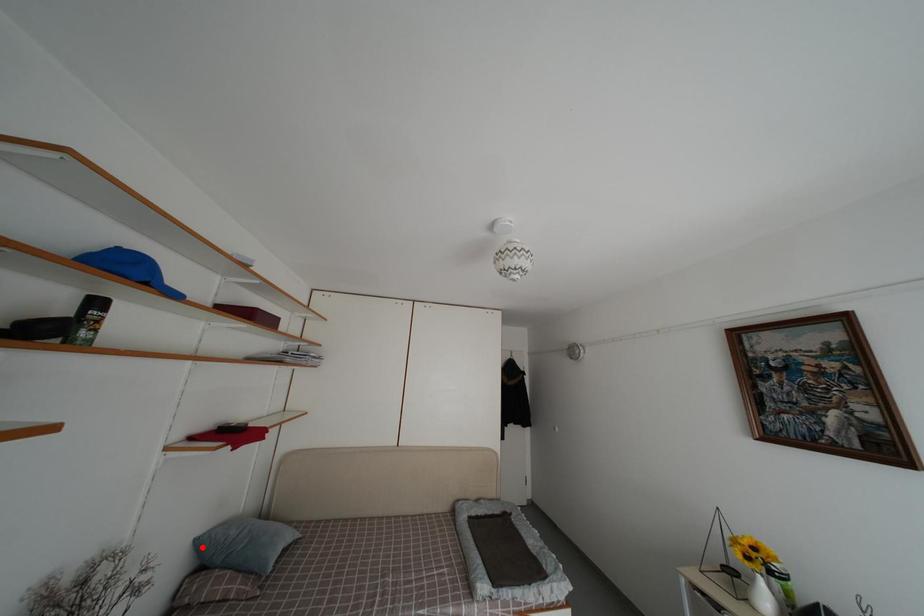
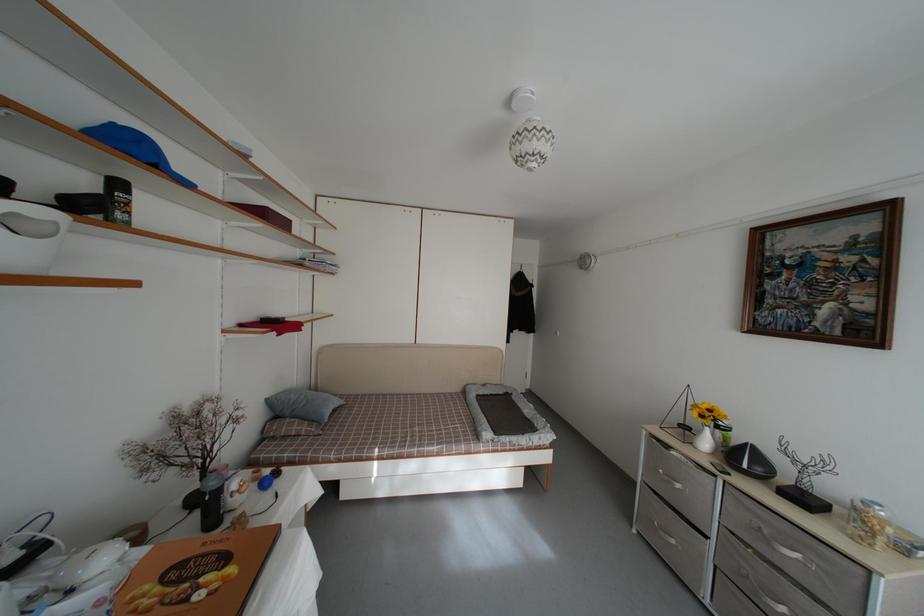
The point at the highlighted location is marked in the first image. Where is the corresponding point in the second image?

(274, 407)